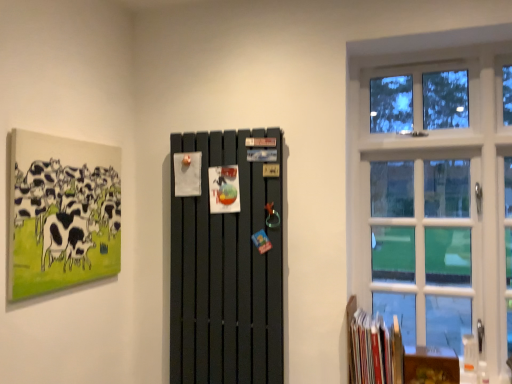
Identify the location of matte canvas painting of cows at upper left. (61, 213).

What is the approximate height of matte black radiator at center?

matte black radiator at center is 4.20 feet tall.

What do you see at coordinates (375, 350) in the screenshot? This screenshot has width=512, height=384. I see `hardcover books at lower right` at bounding box center [375, 350].

Identify the location of matte canvas painting of cows at upper left. (61, 213).

Is matte canvas painting of cows at upper left far away from matte black radiator at center?

matte canvas painting of cows at upper left is actually quite close to matte black radiator at center.

Which is in front, point (48, 246) or point (194, 138)?

Positioned in front is point (48, 246).

From a real-world perspective, who is located lower, matte canvas painting of cows at upper left or matte black radiator at center?

matte black radiator at center.

Is the depth of matte black radiator at center less than that of white glass window at right?

Yes, matte black radiator at center is in front of white glass window at right.

In the scene shown: Can you tell me how much matte black radiator at center and white glass window at right differ in facing direction?

The angle between the facing direction of matte black radiator at center and the facing direction of white glass window at right is 151 degrees.

Are matte black radiator at center and white glass window at right located far from each other?

No, matte black radiator at center is in close proximity to white glass window at right.

Does matte black radiator at center have a lesser width compared to white glass window at right?

Yes, matte black radiator at center is thinner than white glass window at right.

Which object is wider, matte canvas painting of cows at upper left or white glass window at right?

With larger width is white glass window at right.

In the image, is matte canvas painting of cows at upper left on the left side or the right side of white glass window at right?

matte canvas painting of cows at upper left is to the left of white glass window at right.

From the image's perspective, does matte canvas painting of cows at upper left appear higher than white glass window at right?

Correct, matte canvas painting of cows at upper left appears higher than white glass window at right in the image.

Is matte canvas painting of cows at upper left taller than white glass window at right?

No.

Locate an element on the screen. picture frame located in front of the hardcover books at lower right is located at coordinates (61, 213).

Which of these two, hardcover books at lower right or matte canvas painting of cows at upper left, is smaller?

matte canvas painting of cows at upper left.

Which is more to the right, hardcover books at lower right or matte canvas painting of cows at upper left?

Positioned to the right is hardcover books at lower right.

Is hardcover books at lower right oriented towards matte canvas painting of cows at upper left?

No, hardcover books at lower right does not turn towards matte canvas painting of cows at upper left.

Is point (434, 171) closer or farther from the camera than point (61, 283)?

Point (434, 171) is farther from the camera than point (61, 283).

Is white glass window at right to the left of matte canvas painting of cows at upper left from the viewer's perspective?

No, white glass window at right is not to the left of matte canvas painting of cows at upper left.

At what (x,y) coordinates should I click in order to perform the action: click on picture frame above the white glass window at right (from the image's perspective). Please return your answer as a coordinate pair (x, y). Looking at the image, I should click on (61, 213).

From the picture: Is white glass window at right positioned with its back to matte canvas painting of cows at upper left?

That's not correct — white glass window at right is not looking away from matte canvas painting of cows at upper left.

Does matte black radiator at center appear on the right side of matte canvas painting of cows at upper left?

Yes.

Can you see matte black radiator at center touching matte canvas painting of cows at upper left?

No.

From a real-world perspective, is matte black radiator at center positioned above or below matte canvas painting of cows at upper left?

In terms of real-world spatial position, matte black radiator at center is below matte canvas painting of cows at upper left.

How different are the orientations of white glass window at right and hardcover books at lower right in degrees?

white glass window at right and hardcover books at lower right are facing 0.28 degrees away from each other.

From the image's perspective, which is above, white glass window at right or hardcover books at lower right?

white glass window at right is shown above in the image.

Considering their positions, is white glass window at right located in front of or behind hardcover books at lower right?

In the image, white glass window at right appears behind hardcover books at lower right.

At what (x,y) coordinates should I click in order to perform the action: click on picture frame in front of the matte black radiator at center. Please return your answer as a coordinate pair (x, y). Looking at the image, I should click on tap(61, 213).

Find the location of a particular element. The height and width of the screenshot is (384, 512). barn door located underneath the white glass window at right (from a real-world perspective) is located at coordinates (226, 270).

From the image, which object appears to be nearer to hardcover books at lower right, white glass window at right or matte black radiator at center?

matte black radiator at center is positioned closer to the anchor hardcover books at lower right.

Based on their spatial positions, is hardcover books at lower right or white glass window at right closer to matte black radiator at center?

hardcover books at lower right is closer to matte black radiator at center.

From the image, which object appears to be nearer to matte black radiator at center, matte canvas painting of cows at upper left or white glass window at right?

matte canvas painting of cows at upper left.

Looking at the image, which one is located further to white glass window at right, hardcover books at lower right or matte canvas painting of cows at upper left?

matte canvas painting of cows at upper left is positioned further to the anchor white glass window at right.

In the scene shown: Estimate the real-world distances between objects in this image. Which object is further from matte canvas painting of cows at upper left, white glass window at right or hardcover books at lower right?

white glass window at right.

Considering their positions, is white glass window at right positioned further to matte black radiator at center than matte canvas painting of cows at upper left?

white glass window at right is further to matte black radiator at center.

From the image, which object appears to be farther from white glass window at right, hardcover books at lower right or matte black radiator at center?

matte black radiator at center is positioned further to the anchor white glass window at right.

Looking at the image, which one is located closer to white glass window at right, matte black radiator at center or hardcover books at lower right?

Based on the image, hardcover books at lower right appears to be nearer to white glass window at right.

You are a GUI agent. You are given a task and a screenshot of the screen. Output one action in this format:
    pyautogui.click(x=<x>, y=<y>)
    Task: Click on the book situated between matte canvas painting of cows at upper left and white glass window at right from left to right
    The image size is (512, 384).
    Given the screenshot: What is the action you would take?
    pyautogui.click(x=375, y=350)

This screenshot has width=512, height=384. I want to click on barn door between matte canvas painting of cows at upper left and hardcover books at lower right from left to right, so click(226, 270).

Find the location of a particular element. The image size is (512, 384). book between matte black radiator at center and white glass window at right in the horizontal direction is located at coordinates (375, 350).

Locate an element on the screen. This screenshot has height=384, width=512. barn door situated between matte canvas painting of cows at upper left and white glass window at right from left to right is located at coordinates (226, 270).